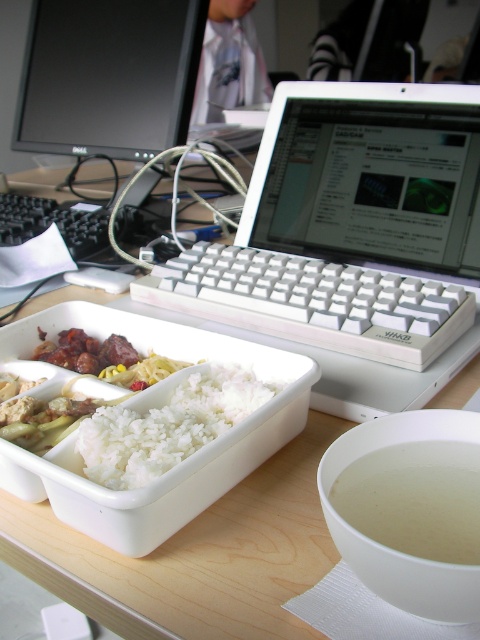
You are organizing your desk and want to move the white plastic laptop at center closer to the translucent white soup at lower right. Based on their positions, can you move the laptop directly downward without lifting it?

The white plastic laptop at center is above the translucent white soup at lower right, so moving it directly downward would place it over the soup. However, since the laptop is electronic equipment, it should not be placed directly on top of liquid to avoid damage. Consider moving it to the side instead.

You are standing 12 inches away from the desk. Can you reach the point located at coordinates point (424,528) without moving your position?

The distance of point (424,528) from viewer is 11.01 inches, so yes, you can reach it since it is within your 12 inches reach distance.

You are organizing your desk and need to move the white plastic laptop at center closer to the translucent white soup at lower right. Based on their positions, which direction should you move the laptop?

The white plastic laptop at center is to the left of the translucent white soup at lower right, so you should move it to the right to bring it closer.